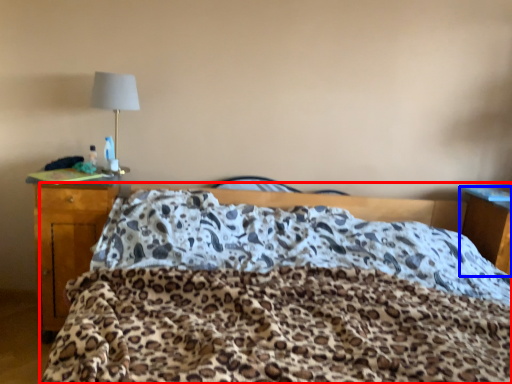
Question: Which object is closer to the camera taking this photo, bed (highlighted by a red box) or nightstand (highlighted by a blue box)?

Choices:
 (A) bed
 (B) nightstand

Answer: (A)